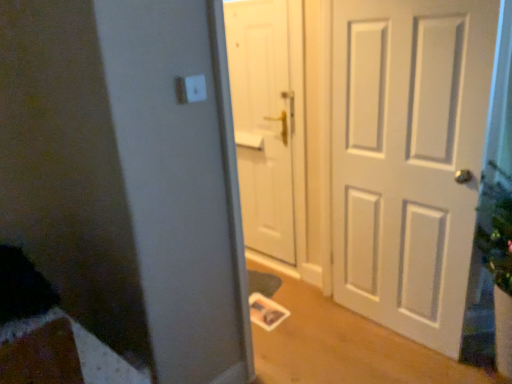
Question: Can white plastic light switch at upper center be found inside white matte door at right, the first door positioned from the right?

Choices:
 (A) no
 (B) yes

Answer: (A)

Question: Is white matte door at right, the first door positioned from the right, far from white plastic light switch at upper center?

Choices:
 (A) yes
 (B) no

Answer: (A)

Question: From the image's perspective, would you say white matte door at right, the first door positioned from the right, is shown under white plastic light switch at upper center?

Choices:
 (A) yes
 (B) no

Answer: (A)

Question: Can you confirm if white matte door at right, the 2th door from the left, is smaller than white plastic light switch at upper center?

Choices:
 (A) yes
 (B) no

Answer: (B)

Question: Is the position of white matte door at right, the first door positioned from the right, less distant than that of white plastic light switch at upper center?

Choices:
 (A) yes
 (B) no

Answer: (B)

Question: Is point (187, 77) positioned closer to the camera than point (243, 14)?

Choices:
 (A) farther
 (B) closer

Answer: (B)

Question: Is white plastic light switch at upper center in front of or behind white matte door at center, which is the 1th door in left-to-right order, in the image?

Choices:
 (A) behind
 (B) front

Answer: (B)

Question: Is white plastic light switch at upper center to the left or to the right of white matte door at center, the 2th door from the right, in the image?

Choices:
 (A) left
 (B) right

Answer: (A)

Question: From a real-world perspective, is white plastic light switch at upper center physically located above or below white matte door at center, which is the 1th door in left-to-right order?

Choices:
 (A) below
 (B) above

Answer: (B)

Question: Choose the correct answer: Is white matte door at center, the 2th door from the right, inside white matte door at right, the 2th door from the left, or outside it?

Choices:
 (A) inside
 (B) outside

Answer: (B)

Question: Relative to white matte door at right, the first door positioned from the right, is white matte door at center, which is the 1th door in left-to-right order, in front or behind?

Choices:
 (A) behind
 (B) front

Answer: (A)

Question: Is white matte door at center, the 2th door from the right, to the left or to the right of white matte door at right, the 2th door from the left, in the image?

Choices:
 (A) right
 (B) left

Answer: (B)

Question: From the image's perspective, is white matte door at center, which is the 1th door in left-to-right order, above or below white matte door at right, the 2th door from the left?

Choices:
 (A) below
 (B) above

Answer: (B)

Question: Considering the positions of white matte door at center, the 2th door from the right, and white plastic light switch at upper center in the image, is white matte door at center, the 2th door from the right, bigger or smaller than white plastic light switch at upper center?

Choices:
 (A) big
 (B) small

Answer: (A)

Question: Is white matte door at center, the 2th door from the right, taller or shorter than white plastic light switch at upper center?

Choices:
 (A) short
 (B) tall

Answer: (B)